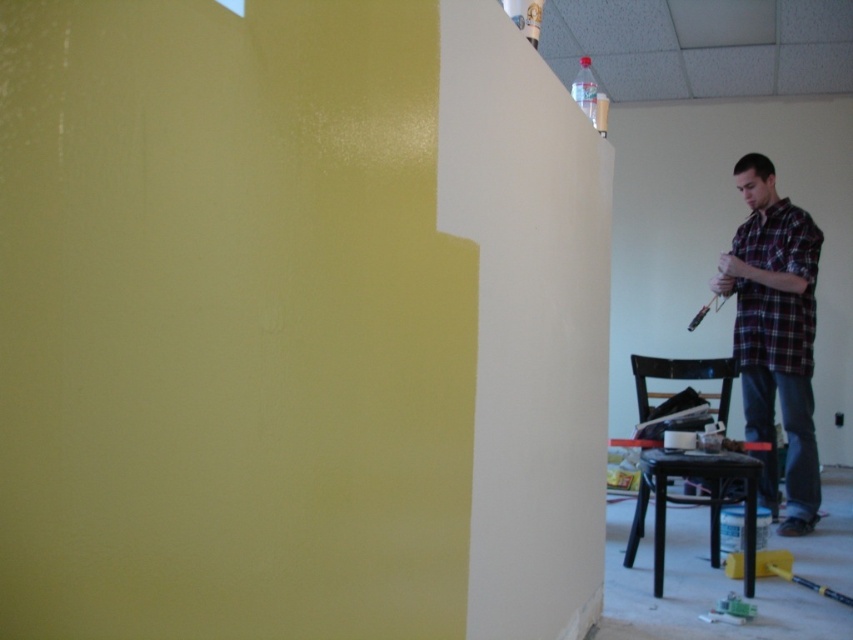
Question: Which point is closer to the camera taking this photo?

Choices:
 (A) (790, 513)
 (B) (746, 456)

Answer: (B)

Question: Which object is positioned closest to the plaid shirt at right?

Choices:
 (A) matte black stool at lower right
 (B) plaid cotton shirt at right

Answer: (B)

Question: Can you confirm if plaid shirt at right is thinner than matte black stool at lower right?

Choices:
 (A) yes
 (B) no

Answer: (A)

Question: Does plaid cotton shirt at right lie behind matte black stool at lower right?

Choices:
 (A) yes
 (B) no

Answer: (A)

Question: Which point is closer to the camera?

Choices:
 (A) (809, 250)
 (B) (746, 564)

Answer: (B)

Question: In this image, where is plaid shirt at right located relative to plaid cotton shirt at right?

Choices:
 (A) right
 (B) left

Answer: (A)